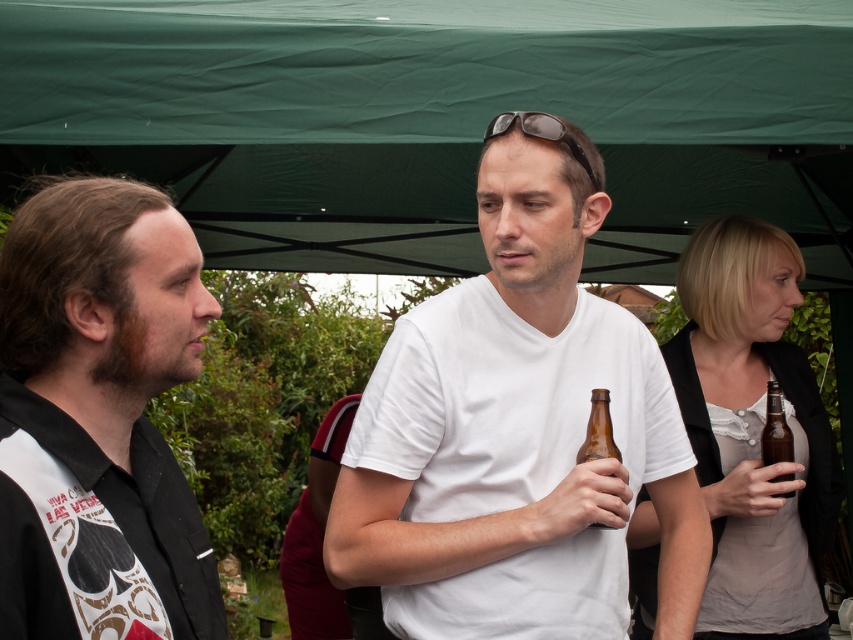
You are a painter standing 1.8 meters tall and want to paint the green fabric canopy at upper center. You have a ladder that is 2.4 meters long. The brown glass bottle at center is in your way. Can you reach the canopy without moving the bottle?

The distance between the green fabric canopy at upper center and the brown glass bottle at center is 2.65 meters. Since the ladder is 2.4 meters long, which is shorter than the distance to the canopy, you cannot reach the canopy without moving the bottle.

Based on the scene described, which object is positioned to the left when comparing the green fabric canopy at upper center and the brown glass bottle at center?

The green fabric canopy at upper center is positioned to the left of the brown glass bottle at center according to the description.